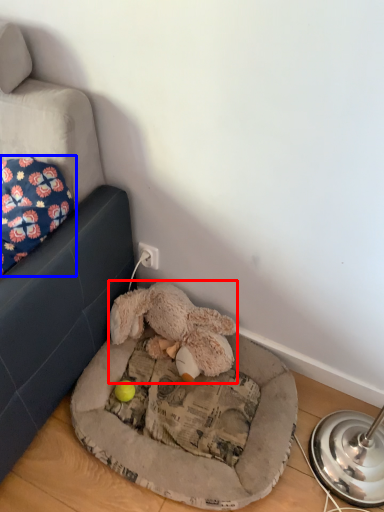
Question: Which object appears farthest to the camera in this image, toy (highlighted by a red box) or pillow (highlighted by a blue box)?

Choices:
 (A) toy
 (B) pillow

Answer: (A)